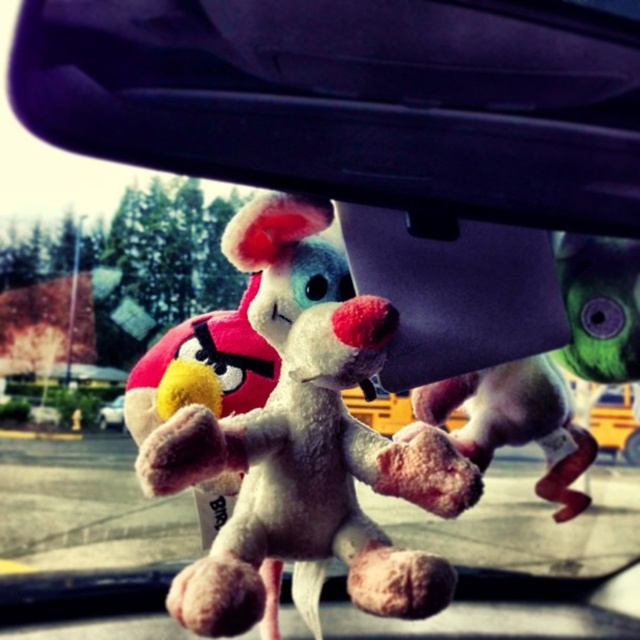
You are a passenger in the car and want to reach the black plastic rearview mirror at upper center and the metallic silver car at lower left. Which object is closer to you?

The black plastic rearview mirror at upper center is closer to the viewer than the metallic silver car at lower left.